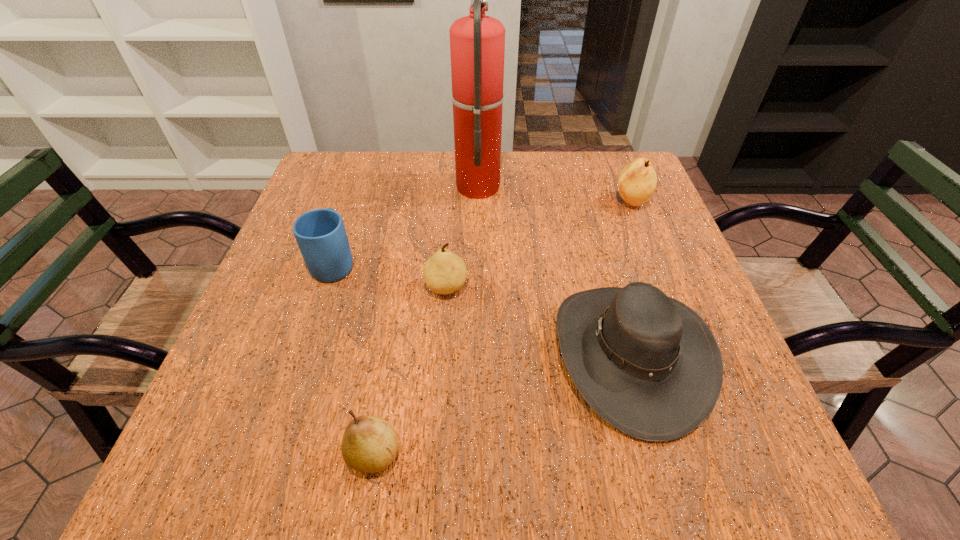
Where is `fire extinguisher`? fire extinguisher is located at coordinates (477, 42).

Locate an element on the screen. This screenshot has width=960, height=540. the farthest pear is located at coordinates (637, 181).

What are the coordinates of `the leftmost object` in the screenshot? It's located at (320, 234).

This screenshot has width=960, height=540. In order to click on the second nearest pear in this screenshot , I will do `click(444, 272)`.

What are the coordinates of `cowboy hat` in the screenshot? It's located at (646, 363).

Identify the location of the shortest pear. (369, 444).

Identify the location of the shortest object. This screenshot has width=960, height=540. (369, 444).

Find the location of a particular element. Image resolution: width=960 pixels, height=540 pixels. free region located with the nozzle and gauge on the fire extinguisher is located at coordinates (575, 185).

Find the location of a particular element. The image size is (960, 540). free space located 0.200m on the back of the rightmost pear is located at coordinates (611, 151).

Identify the location of free point located on the side of the mug with the handle. (362, 178).